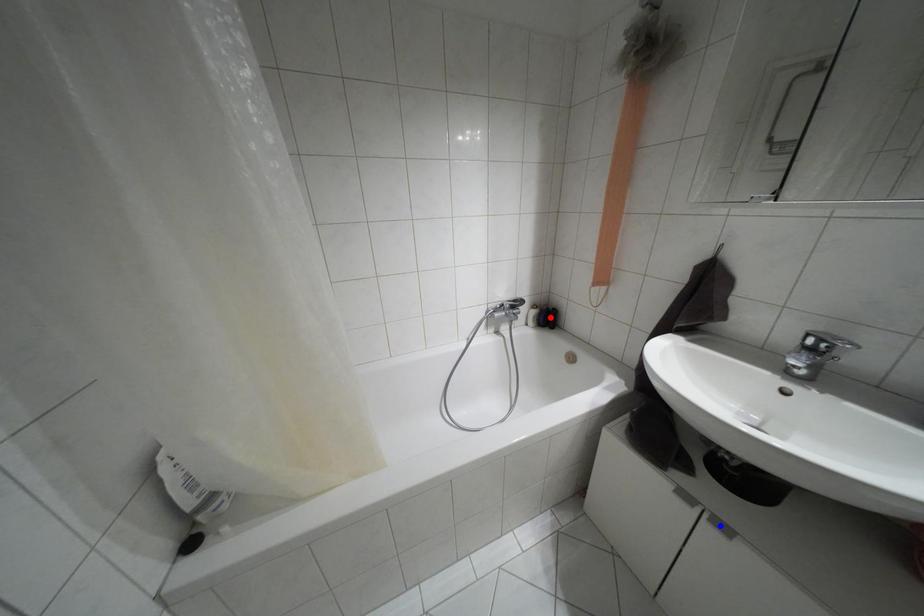
Question: In the image, two points are highlighted. Which point is nearer to the camera? Reply with the corresponding letter.

Choices:
 (A) blue point
 (B) red point

Answer: (A)